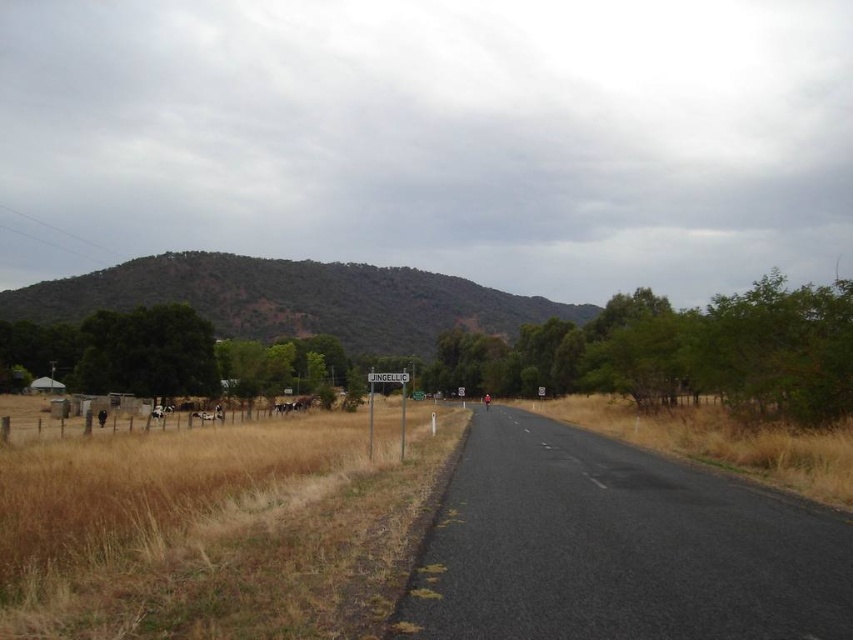
Can you confirm if dry grass at left is smaller than dry grass at road center?

Yes, dry grass at left is smaller than dry grass at road center.

Which of these two, dry grass at left or dry grass at road center, stands taller?

dry grass at road center is taller.

Find the location of a particular element. This screenshot has height=640, width=853. dry grass at left is located at coordinates (210, 525).

Between dry grass at left and white woolly sheep at left, which one appears on the left side from the viewer's perspective?

white woolly sheep at left is more to the left.

Who is taller, dry grass at left or white woolly sheep at left?

dry grass at left

Is point (96, 605) behind point (158, 406)?

That is False.

You are a GUI agent. You are given a task and a screenshot of the screen. Output one action in this format:
    pyautogui.click(x=<x>, y=<y>)
    Task: Click on the dry grass at left
    This screenshot has width=853, height=640.
    Given the screenshot: What is the action you would take?
    pyautogui.click(x=210, y=525)

Between green textured hill at center and dry grass at road center, which one has more height?

green textured hill at center

Does green textured hill at center have a larger size compared to dry grass at road center?

Indeed, green textured hill at center has a larger size compared to dry grass at road center.

Is point (407, 339) positioned in front of point (683, 436)?

No, (407, 339) is behind (683, 436).

Where is `green textured hill at center`? green textured hill at center is located at coordinates (293, 300).